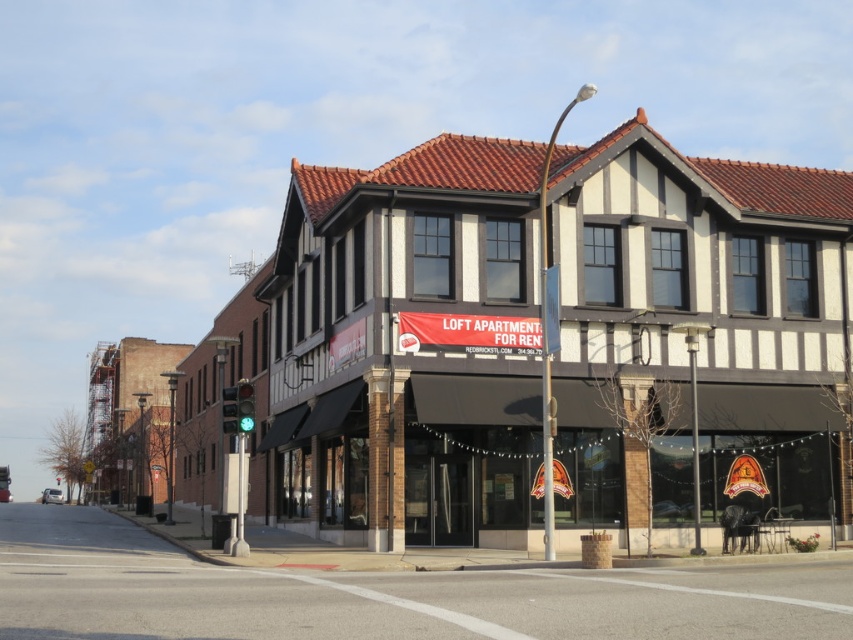
You are standing on the sidewalk across the street from the white brick building at center. You want to take a photo of it with your smartphone, which has a maximum zoom range of 100 feet. Can you capture the entire building in one shot without moving closer?

The white brick building at center is 92.70 feet away from the viewer. Since your smartphone has a maximum zoom range of 100 feet, you can capture the entire building in one shot without moving closer.

You are a delivery person standing on the smooth concrete sidewalk at lower center. You need to deliver a package to the white brick building at center. Which direction should you walk to reach the building?

The white brick building at center is to the right of the smooth concrete sidewalk at lower center, so you should walk to the right to reach the building.